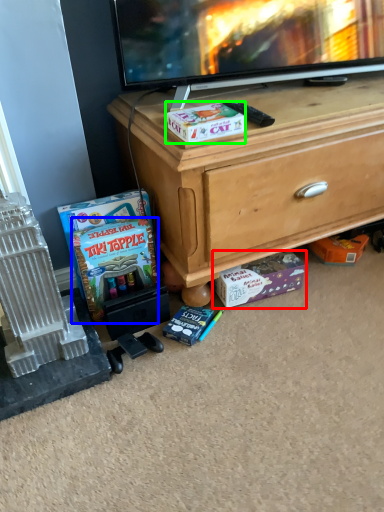
Question: Based on their relative distances, which object is nearer to cardboard box (highlighted by a red box)? Choose from comic book (highlighted by a blue box) and box (highlighted by a green box).

Choices:
 (A) comic book
 (B) box

Answer: (A)